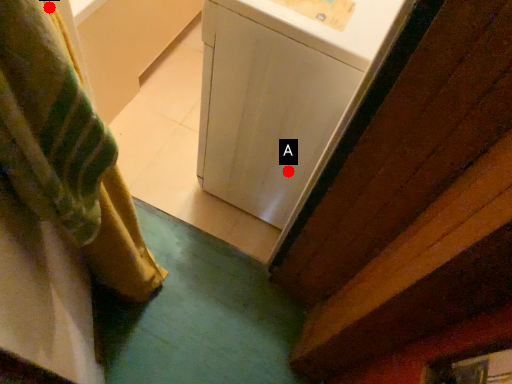
Question: Two points are circled on the image, labeled by A and B beside each circle. Which point appears farthest from the camera in this image?

Choices:
 (A) A is further
 (B) B is further

Answer: (A)